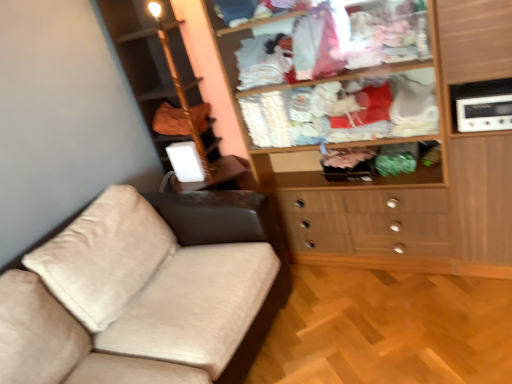
Question: In the image, is brown fabric bag at upper left on the left side or the right side of white plastic radio at upper right?

Choices:
 (A) right
 (B) left

Answer: (B)

Question: From the image's perspective, is brown fabric bag at upper left located above or below white plastic radio at upper right?

Choices:
 (A) above
 (B) below

Answer: (A)

Question: Which object is positioned closest to the wooden wardrobe at upper right?

Choices:
 (A) brown fabric bag at upper left
 (B) white plastic radio at upper right

Answer: (B)

Question: Based on their relative distances, which object is nearer to the wooden wardrobe at upper right?

Choices:
 (A) white plastic radio at upper right
 (B) brown fabric bag at upper left

Answer: (A)